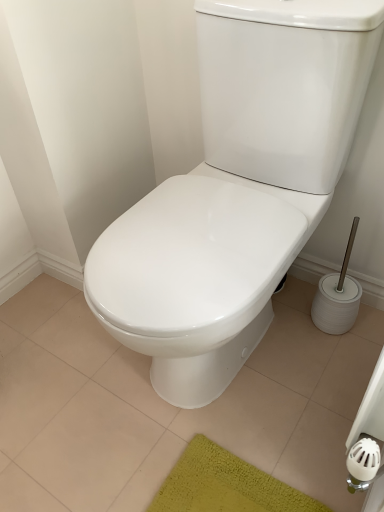
Identify the location of white glossy toilet at center. This screenshot has width=384, height=512. (168, 405).

Measure the distance between point (x=312, y=285) and camera.

Point (x=312, y=285) is 1.30 meters away from camera.

Image resolution: width=384 pixels, height=512 pixels. What do you see at coordinates (168, 405) in the screenshot?
I see `white glossy toilet at center` at bounding box center [168, 405].

At what (x,y) coordinates should I click in order to perform the action: click on white glossy toilet at center. Please return your answer as a coordinate pair (x, y). The height and width of the screenshot is (512, 384). Looking at the image, I should click on (237, 189).

What do you see at coordinates (237, 189) in the screenshot? The height and width of the screenshot is (512, 384). I see `white glossy toilet at center` at bounding box center [237, 189].

Locate an element on the screen. The width and height of the screenshot is (384, 512). white glossy toilet at center is located at coordinates (168, 405).

Consider the image. Which object is positioned more to the right, white glossy toilet at center or white glossy toilet at center?

Positioned to the right is white glossy toilet at center.

Which is behind, white glossy toilet at center or white glossy toilet at center?

Positioned behind is white glossy toilet at center.

Which is in front, point (296, 17) or point (131, 448)?

The point (296, 17) is in front.

From the image's perspective, does white glossy toilet at center appear higher than white glossy toilet at center?

Correct, white glossy toilet at center appears higher than white glossy toilet at center in the image.

From a real-world perspective, is white glossy toilet at center above or below white glossy toilet at center?

In terms of real-world spatial position, white glossy toilet at center is above white glossy toilet at center.

Considering the sizes of white glossy toilet at center and white glossy toilet at center in the image, is white glossy toilet at center wider or thinner than white glossy toilet at center?

Considering their sizes, white glossy toilet at center looks slimmer than white glossy toilet at center.

Considering the relative sizes of white glossy toilet at center and white glossy toilet at center in the image provided, is white glossy toilet at center taller than white glossy toilet at center?

Correct, white glossy toilet at center is much taller as white glossy toilet at center.

Can you confirm if white glossy toilet at center is smaller than white glossy toilet at center?

No.

Is white glossy toilet at center inside or outside of white glossy toilet at center?

white glossy toilet at center cannot be found inside white glossy toilet at center.

Is white glossy toilet at center not near white glossy toilet at center?

That's not correct — white glossy toilet at center is a little close to white glossy toilet at center.

Is white glossy toilet at center looking in the opposite direction of white glossy toilet at center?

No, white glossy toilet at center is not facing away from white glossy toilet at center.

How many degrees apart are the facing directions of white glossy toilet at center and white glossy toilet at center?

The angular difference between white glossy toilet at center and white glossy toilet at center is 0.648 degrees.

This screenshot has height=512, width=384. Find the location of `tile to the left of white glossy toilet at center`. tile to the left of white glossy toilet at center is located at coordinates (168, 405).

Between white glossy toilet at center and white glossy toilet at center, which one appears on the left side from the viewer's perspective?

white glossy toilet at center.

In the image, is white glossy toilet at center positioned in front of or behind white glossy toilet at center?

Visually, white glossy toilet at center is located behind white glossy toilet at center.

Which is less distant, (328, 356) or (249, 209)?

Point (328, 356) is farther from the camera than point (249, 209).

From the image's perspective, who appears lower, white glossy toilet at center or white glossy toilet at center?

white glossy toilet at center, from the image's perspective.

From a real-world perspective, is white glossy toilet at center above or below white glossy toilet at center?

Clearly, from a real-world perspective, white glossy toilet at center is below white glossy toilet at center.

Between white glossy toilet at center and white glossy toilet at center, which one has smaller width?

white glossy toilet at center.

Does white glossy toilet at center have a greater height compared to white glossy toilet at center?

No, white glossy toilet at center is not taller than white glossy toilet at center.

Considering the sizes of objects white glossy toilet at center and white glossy toilet at center in the image provided, who is bigger, white glossy toilet at center or white glossy toilet at center?

With larger size is white glossy toilet at center.

Would you say white glossy toilet at center is inside or outside white glossy toilet at center?

white glossy toilet at center is not enclosed by white glossy toilet at center.

Is white glossy toilet at center next to white glossy toilet at center?

No, white glossy toilet at center is not making contact with white glossy toilet at center.

Is white glossy toilet at center aimed at white glossy toilet at center?

No, white glossy toilet at center is not turned towards white glossy toilet at center.

How many degrees apart are the facing directions of white glossy toilet at center and white glossy toilet at center?

The facing directions of white glossy toilet at center and white glossy toilet at center are 0.648 degrees apart.

Find the location of a particular element. Image resolution: width=384 pixels, height=512 pixels. toilet above the white glossy toilet at center (from a real-world perspective) is located at coordinates (237, 189).

You are a GUI agent. You are given a task and a screenshot of the screen. Output one action in this format:
    pyautogui.click(x=<x>, y=<y>)
    Task: Click on the tile on the left of white glossy toilet at center
    
    Given the screenshot: What is the action you would take?
    pyautogui.click(x=168, y=405)

The width and height of the screenshot is (384, 512). Find the location of `toilet that appears on the right of white glossy toilet at center`. toilet that appears on the right of white glossy toilet at center is located at coordinates (237, 189).